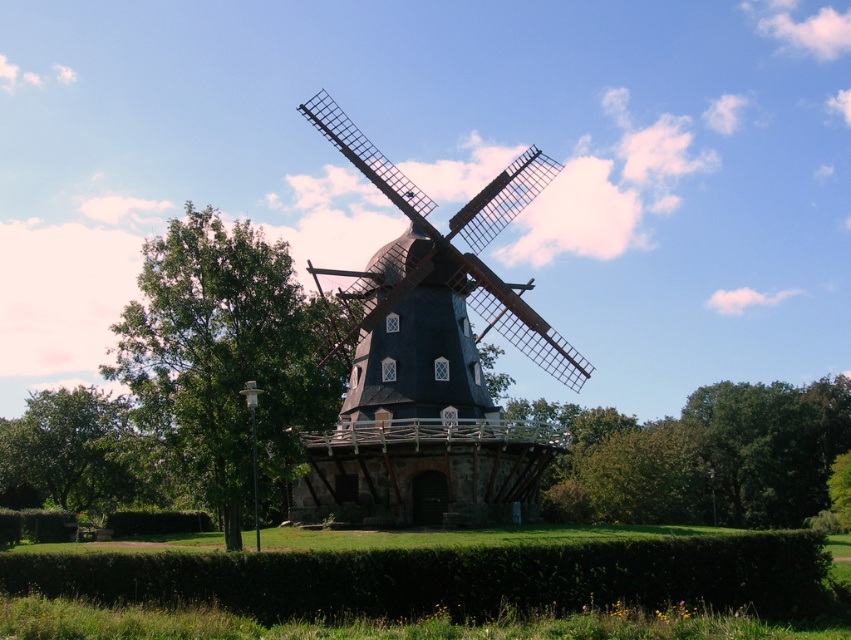
Can you confirm if dark gray wooden windmill at center is positioned above green leafy hedge at lower center?

Yes, dark gray wooden windmill at center is above green leafy hedge at lower center.

The height and width of the screenshot is (640, 851). Find the location of `dark gray wooden windmill at center`. dark gray wooden windmill at center is located at coordinates (432, 364).

Is dark gray wooden windmill at center to the right of green leafy tree at lower left from the viewer's perspective?

Correct, you'll find dark gray wooden windmill at center to the right of green leafy tree at lower left.

Describe the element at coordinates (432, 364) in the screenshot. The width and height of the screenshot is (851, 640). I see `dark gray wooden windmill at center` at that location.

Is point (352, 403) behind point (127, 472)?

No, (352, 403) is in front of (127, 472).

Where is `dark gray wooden windmill at center`? dark gray wooden windmill at center is located at coordinates (432, 364).

Can you confirm if green leafy hedge at lower center is positioned below green leafy tree at left?

Correct, green leafy hedge at lower center is located below green leafy tree at left.

What do you see at coordinates (452, 577) in the screenshot? This screenshot has height=640, width=851. I see `green leafy hedge at lower center` at bounding box center [452, 577].

I want to click on green leafy hedge at lower center, so click(452, 577).